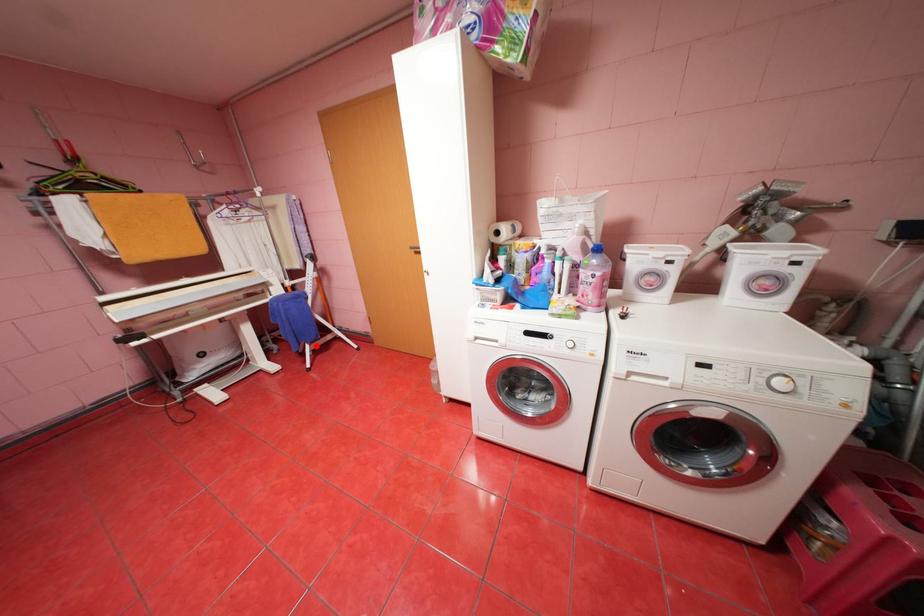
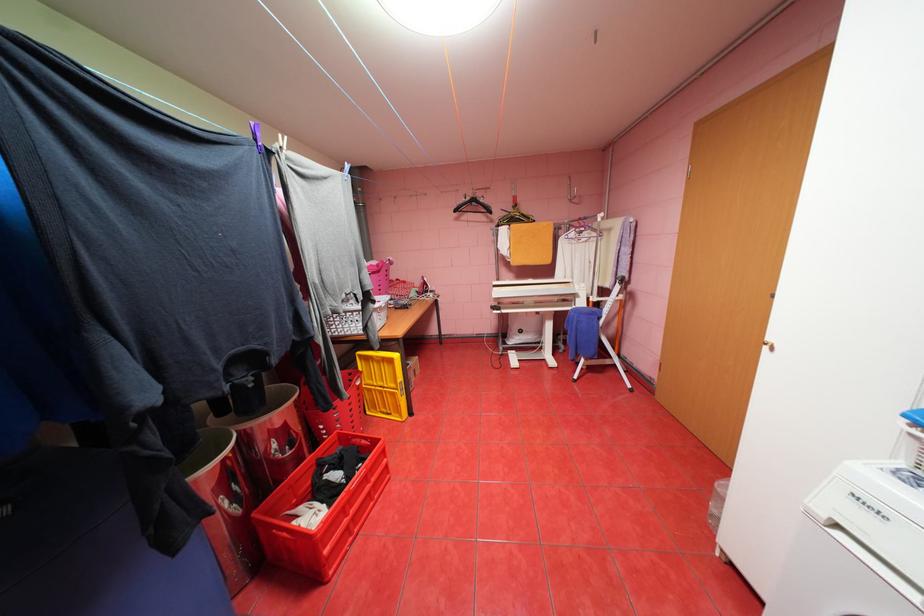
Locate, in the second image, the point that corresponds to the highlighted location in the first image.

(591, 360)